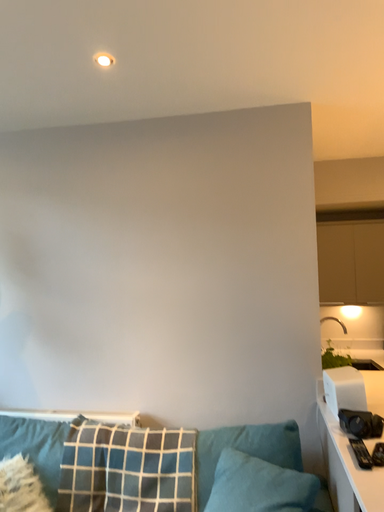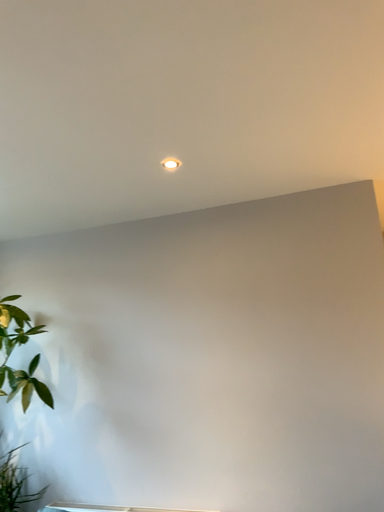
Question: Which way did the camera rotate in the video?

Choices:
 (A) rotated upward
 (B) rotated downward

Answer: (A)